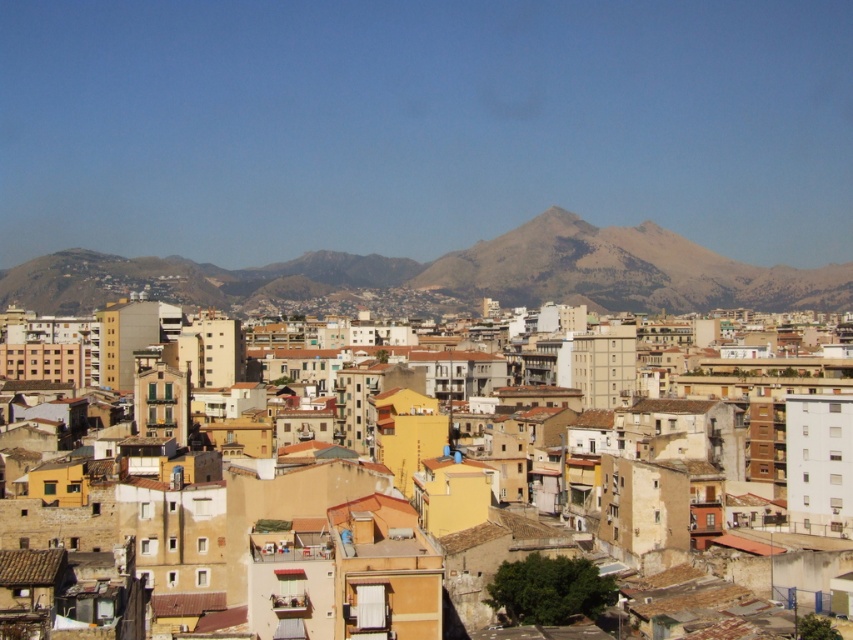
Consider the image. You are standing at the point closest to you in the image. Looking towards the distant mountains, you notice two points marked in the scene. Which of the two points, point (589, 301) or point (155, 564), is closer to your current position?

Point (155, 564) is closer to your current position because the description states that point (589, 301) is behind point (155, 564).